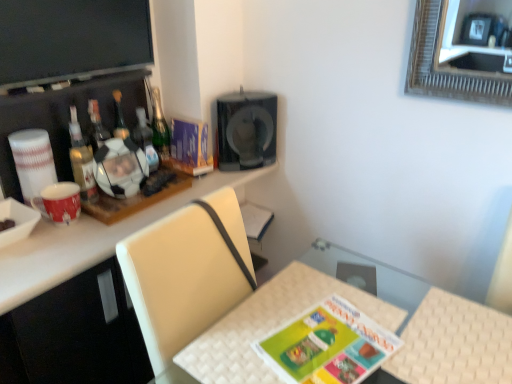
How much space does green glass bottle at upper center, which appears as the fourth bottle when viewed from the left, occupy horizontally?

green glass bottle at upper center, which appears as the fourth bottle when viewed from the left, is 7.32 centimeters wide.

Where is `green glass bottle at upper center, which appears as the 1th bottle when viewed from the right`? Image resolution: width=512 pixels, height=384 pixels. green glass bottle at upper center, which appears as the 1th bottle when viewed from the right is located at coordinates (160, 128).

The height and width of the screenshot is (384, 512). Describe the element at coordinates (246, 130) in the screenshot. I see `glossy plastic speaker at upper center` at that location.

Where is `translucent glass bottle at upper left, acting as the second bottle starting from the right`? The image size is (512, 384). translucent glass bottle at upper left, acting as the second bottle starting from the right is located at coordinates (145, 139).

This screenshot has width=512, height=384. I want to click on translucent glass bottle at left, the 4th bottle when ordered from right to left, so click(81, 160).

The width and height of the screenshot is (512, 384). What do you see at coordinates (328, 345) in the screenshot?
I see `matte green board game at center` at bounding box center [328, 345].

Find the location of a particular element. The width and height of the screenshot is (512, 384). matte red cup at left is located at coordinates (59, 202).

At what (x,y) coordinates should I click in order to perform the action: click on white glossy soccer ball at upper left, placed as the second bottle when sorted from left to right. Please return your answer as a coordinate pair (x, y). The image size is (512, 384). Looking at the image, I should click on (120, 118).

The width and height of the screenshot is (512, 384). I want to click on green glass bottle at upper center, which appears as the fourth bottle when viewed from the left, so click(x=160, y=128).

Are white glossy soccer ball at upper left, which appears as the third bottle when viewed from the right, and matte purple magazine at upper center making contact?

No, white glossy soccer ball at upper left, which appears as the third bottle when viewed from the right, is not beside matte purple magazine at upper center.

From a real-world perspective, who is located higher, white glossy soccer ball at upper left, which appears as the third bottle when viewed from the right, or matte purple magazine at upper center?

white glossy soccer ball at upper left, which appears as the third bottle when viewed from the right.

Where is `magazine below the white glossy soccer ball at upper left, placed as the second bottle when sorted from left to right (from a real-world perspective)`? Image resolution: width=512 pixels, height=384 pixels. magazine below the white glossy soccer ball at upper left, placed as the second bottle when sorted from left to right (from a real-world perspective) is located at coordinates (190, 147).

Is white glossy soccer ball at upper left, which appears as the third bottle when viewed from the right, facing away from matte purple magazine at upper center?

No, matte purple magazine at upper center is not at the back of white glossy soccer ball at upper left, which appears as the third bottle when viewed from the right.

From a real-world perspective, between matte red cup at left and glossy plastic speaker at upper center, who is vertically lower?

matte red cup at left is physically lower.

Would you say glossy plastic speaker at upper center is part of matte red cup at left's contents?

No.

Is matte red cup at left looking in the opposite direction of glossy plastic speaker at upper center?

That's not correct — matte red cup at left is not looking away from glossy plastic speaker at upper center.

From the image's perspective, between matte red cup at left and glossy plastic speaker at upper center, which one is located above?

glossy plastic speaker at upper center.

Choose the correct answer: Is translucent glass bottle at upper left, acting as the second bottle starting from the right, inside glossy plastic speaker at upper center or outside it?

translucent glass bottle at upper left, acting as the second bottle starting from the right, is not enclosed by glossy plastic speaker at upper center.

Could you measure the distance between translucent glass bottle at upper left, which is the 3th bottle from left to right, and glossy plastic speaker at upper center?

translucent glass bottle at upper left, which is the 3th bottle from left to right, is 13.92 inches away from glossy plastic speaker at upper center.

Is translucent glass bottle at upper left, which is the 3th bottle from left to right, positioned far away from glossy plastic speaker at upper center?

No, translucent glass bottle at upper left, which is the 3th bottle from left to right, is not far from glossy plastic speaker at upper center.

Considering the relative sizes of translucent glass bottle at upper left, acting as the second bottle starting from the right, and glossy plastic speaker at upper center in the image provided, is translucent glass bottle at upper left, acting as the second bottle starting from the right, shorter than glossy plastic speaker at upper center?

Yes.

Is white matte bowl at left positioned far away from white glossy desk at upper left?

Actually, white matte bowl at left and white glossy desk at upper left are a little close together.

From a real-world perspective, is white matte bowl at left under white glossy desk at upper left?

No.

Is point (28, 220) farther from viewer compared to point (2, 271)?

That is True.

Who is shorter, white matte bowl at left or white glossy desk at upper left?

Standing shorter between the two is white matte bowl at left.

Can you confirm if green glass bottle at upper center, which appears as the fourth bottle when viewed from the left, is shorter than matte red cup at left?

No.

In terms of size, does green glass bottle at upper center, which appears as the 1th bottle when viewed from the right, appear bigger or smaller than matte red cup at left?

Considering their sizes, green glass bottle at upper center, which appears as the 1th bottle when viewed from the right, takes up more space than matte red cup at left.

The image size is (512, 384). I want to click on the 4th bottle behind when counting from the matte red cup at left, so click(x=160, y=128).

From a real-world perspective, relative to matte red cup at left, is green glass bottle at upper center, which appears as the 1th bottle when viewed from the right, vertically above or below?

In terms of real-world spatial position, green glass bottle at upper center, which appears as the 1th bottle when viewed from the right, is above matte red cup at left.

In order to click on the 2nd bottle behind the white glossy soccer ball at upper left, placed as the second bottle when sorted from left to right, counting from the anchor's position in this screenshot , I will do `click(160, 128)`.

Could you measure the distance between green glass bottle at upper center, which appears as the fourth bottle when viewed from the left, and white glossy soccer ball at upper left, which appears as the third bottle when viewed from the right?

green glass bottle at upper center, which appears as the fourth bottle when viewed from the left, is 5.39 inches away from white glossy soccer ball at upper left, which appears as the third bottle when viewed from the right.

Is green glass bottle at upper center, which appears as the fourth bottle when viewed from the left, facing towards white glossy soccer ball at upper left, which appears as the third bottle when viewed from the right?

No, green glass bottle at upper center, which appears as the fourth bottle when viewed from the left, does not turn towards white glossy soccer ball at upper left, which appears as the third bottle when viewed from the right.

From a real-world perspective, is green glass bottle at upper center, which appears as the 1th bottle when viewed from the right, above or below white glossy soccer ball at upper left, which appears as the third bottle when viewed from the right?

From a real-world perspective, green glass bottle at upper center, which appears as the 1th bottle when viewed from the right, is physically above white glossy soccer ball at upper left, which appears as the third bottle when viewed from the right.

Does point (322, 337) appear closer or farther from the camera than point (155, 153)?

Point (322, 337) is closer to the camera than point (155, 153).

From the picture: Is matte green board game at center oriented away from translucent glass bottle at upper left, acting as the second bottle starting from the right?

That's not correct — matte green board game at center is not looking away from translucent glass bottle at upper left, acting as the second bottle starting from the right.

Does matte green board game at center have a smaller size compared to translucent glass bottle at upper left, acting as the second bottle starting from the right?

Correct, matte green board game at center occupies less space than translucent glass bottle at upper left, acting as the second bottle starting from the right.

Consider the image. Considering the positions of objects matte green board game at center and translucent glass bottle at upper left, acting as the second bottle starting from the right, in the image provided, who is behind, matte green board game at center or translucent glass bottle at upper left, acting as the second bottle starting from the right,?

translucent glass bottle at upper left, acting as the second bottle starting from the right, is behind.

Where is `magazine that is on the right side of white glossy soccer ball at upper left, which appears as the third bottle when viewed from the right`? The height and width of the screenshot is (384, 512). magazine that is on the right side of white glossy soccer ball at upper left, which appears as the third bottle when viewed from the right is located at coordinates (190, 147).

The width and height of the screenshot is (512, 384). In order to click on coffee cup on the left of glossy plastic speaker at upper center in this screenshot , I will do `click(59, 202)`.

Estimate the real-world distances between objects in this image. Which object is further from matte purple magazine at upper center, matte red cup at left or white woven table at lower center?

The object further to matte purple magazine at upper center is white woven table at lower center.

From the image, which object appears to be farther from white woven table at lower center, translucent glass bottle at left, the 4th bottle when ordered from right to left, or matte green board game at center?

Based on the image, translucent glass bottle at left, the 4th bottle when ordered from right to left, appears to be further to white woven table at lower center.

Estimate the real-world distances between objects in this image. Which object is further from matte red cup at left, flat matte screen at upper left or white matte bowl at left?

Among the two, flat matte screen at upper left is located further to matte red cup at left.

Based on their spatial positions, is flat matte screen at upper left or white glossy desk at upper left closer to white glossy soccer ball at upper left, placed as the second bottle when sorted from left to right?

flat matte screen at upper left lies closer to white glossy soccer ball at upper left, placed as the second bottle when sorted from left to right, than the other object.

Based on their spatial positions, is matte red cup at left or matte purple magazine at upper center further from translucent glass bottle at left, the 4th bottle when ordered from right to left?

Based on the image, matte purple magazine at upper center appears to be further to translucent glass bottle at left, the 4th bottle when ordered from right to left.

In the scene shown: From the image, which object appears to be farther from glossy plastic speaker at upper center, translucent glass bottle at left, the 4th bottle when ordered from right to left, or white matte bowl at left?

Among the two, white matte bowl at left is located further to glossy plastic speaker at upper center.

Looking at the image, which one is located further to glossy plastic speaker at upper center, white matte bowl at left or matte red cup at left?

The object further to glossy plastic speaker at upper center is white matte bowl at left.

Estimate the real-world distances between objects in this image. Which object is further from white woven table at lower center, glossy plastic speaker at upper center or white glossy soccer ball at upper left, placed as the second bottle when sorted from left to right?

white glossy soccer ball at upper left, placed as the second bottle when sorted from left to right, is positioned further to the anchor white woven table at lower center.

You are a GUI agent. You are given a task and a screenshot of the screen. Output one action in this format:
    pyautogui.click(x=<x>, y=<y>)
    Task: Click on the table situated between matte red cup at left and matte green board game at center from left to right
    This screenshot has width=512, height=384.
    Given the screenshot: What is the action you would take?
    pyautogui.click(x=271, y=325)

At what (x,y) coordinates should I click in order to perform the action: click on coffee cup between flat matte screen at upper left and white matte bowl at left vertically. Please return your answer as a coordinate pair (x, y). The image size is (512, 384). Looking at the image, I should click on (59, 202).

Where is `bowl between translucent glass bottle at left, which is the first bottle from left to right, and white glossy desk at upper left, in the vertical direction`? bowl between translucent glass bottle at left, which is the first bottle from left to right, and white glossy desk at upper left, in the vertical direction is located at coordinates (17, 221).

This screenshot has height=384, width=512. Identify the location of television between matte red cup at left and matte green board game at center in the horizontal direction. (71, 40).